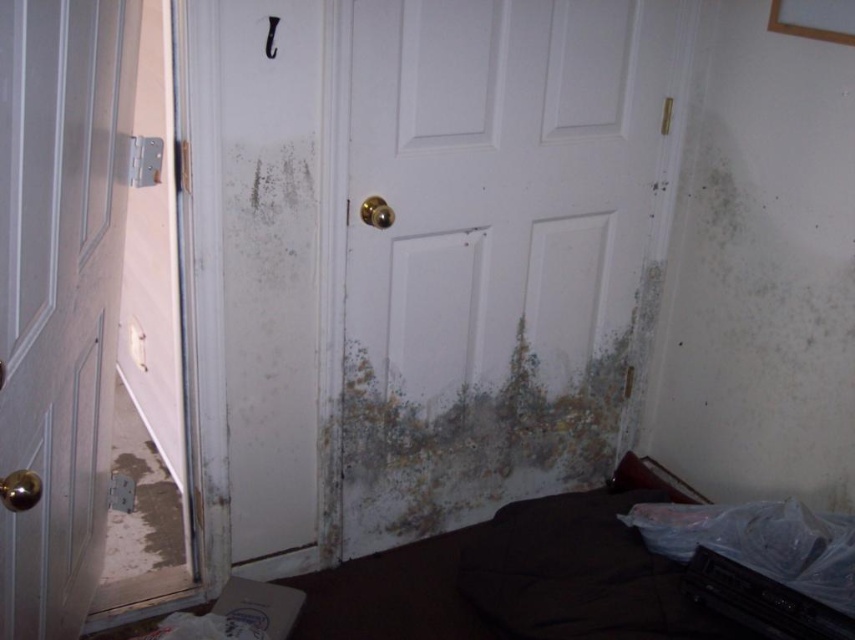
Question: Does white matte door at center have a larger size compared to white matte door at left?

Choices:
 (A) no
 (B) yes

Answer: (B)

Question: Among these points, which one is nearest to the camera?

Choices:
 (A) (124, 12)
 (B) (576, 8)

Answer: (A)

Question: Which point is closer to the camera?

Choices:
 (A) (458, 442)
 (B) (127, 120)

Answer: (B)

Question: Is white matte door at center positioned before white matte door at left?

Choices:
 (A) yes
 (B) no

Answer: (B)

Question: Which object appears farthest from the camera in this image?

Choices:
 (A) white matte door at left
 (B) white matte door at center

Answer: (B)

Question: Does white matte door at center appear on the right side of white matte door at left?

Choices:
 (A) no
 (B) yes

Answer: (B)